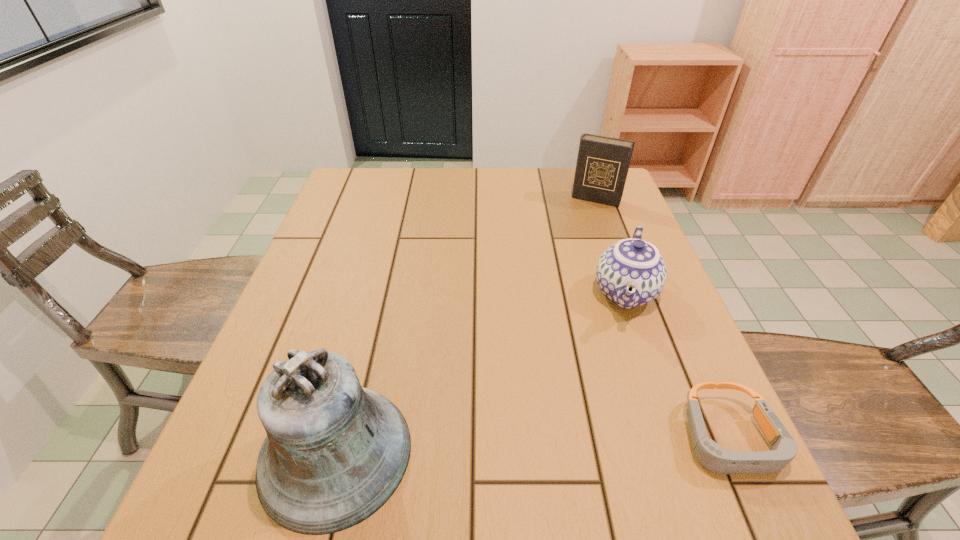
I want to click on free spot on the desktop that is between the leftmost object and the goggles and is positioned from the spout of the second farthest object, so click(x=591, y=444).

The height and width of the screenshot is (540, 960). In order to click on vacant space on the desktop that is between the tallest object and the shortest object and is positioned on the front cover of the farthest object in this screenshot , I will do `click(494, 447)`.